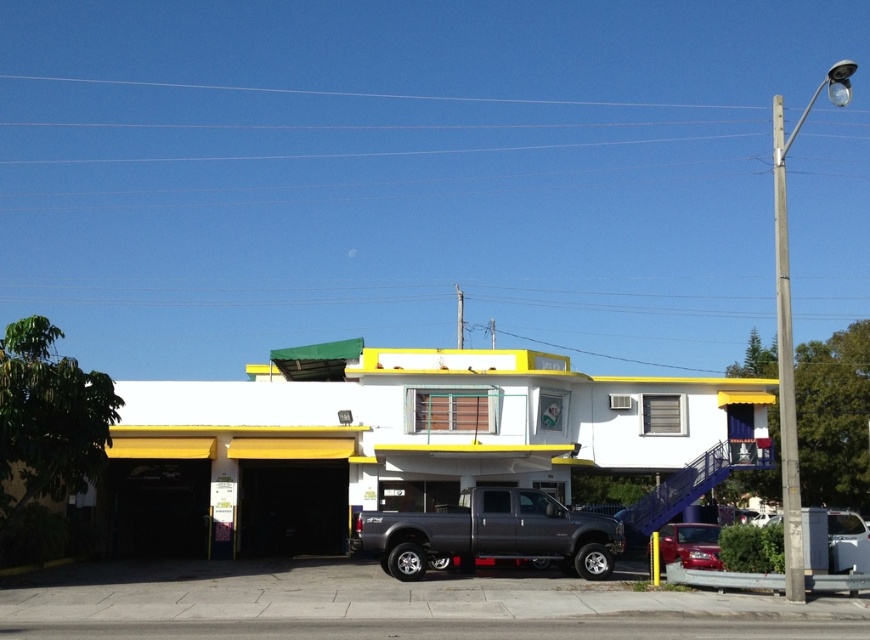
Is matte gray truck at center in front of glossy red car at center?

No, it is not.

Does matte gray truck at center have a lesser height compared to glossy red car at center?

Incorrect, matte gray truck at center's height does not fall short of glossy red car at center's.

At what (x,y) coordinates should I click in order to perform the action: click on matte gray truck at center. Please return your answer as a coordinate pair (x, y). Looking at the image, I should click on (492, 532).

Measure the distance from metallic gray truck at center to glossy red car at center.

metallic gray truck at center is 8.72 meters away from glossy red car at center.

Who is more distant from viewer, (470,445) or (708,532)?

Positioned behind is point (470,445).

Where is `metallic gray truck at center`? This screenshot has width=870, height=640. metallic gray truck at center is located at coordinates (397, 442).

In the scene shown: Is metallic gray truck at center to the right of matte gray truck at center from the viewer's perspective?

Incorrect, metallic gray truck at center is not on the right side of matte gray truck at center.

Between point (375, 476) and point (541, 515), which one is positioned behind?

The point (375, 476) is more distant.

What do you see at coordinates (397, 442) in the screenshot?
I see `metallic gray truck at center` at bounding box center [397, 442].

Where is `metallic gray truck at center`? metallic gray truck at center is located at coordinates (397, 442).